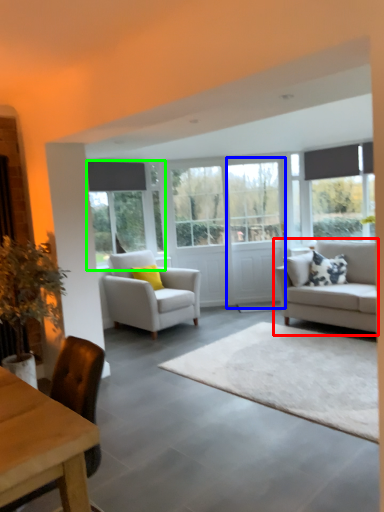
Question: Which is nearer to the studio couch (highlighted by a red box)? glass door (highlighted by a blue box) or window (highlighted by a green box).

Choices:
 (A) glass door
 (B) window

Answer: (A)